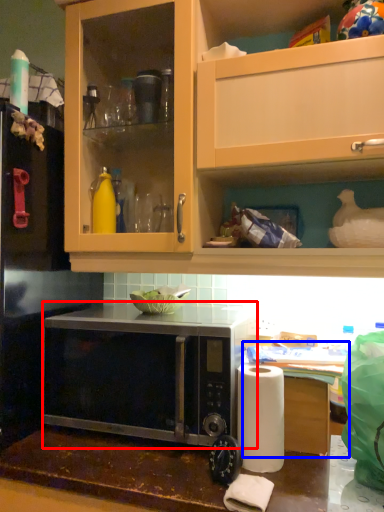
Question: Which object is closer to the camera taking this photo, microwave oven (highlighted by a red box) or table (highlighted by a blue box)?

Choices:
 (A) microwave oven
 (B) table

Answer: (A)